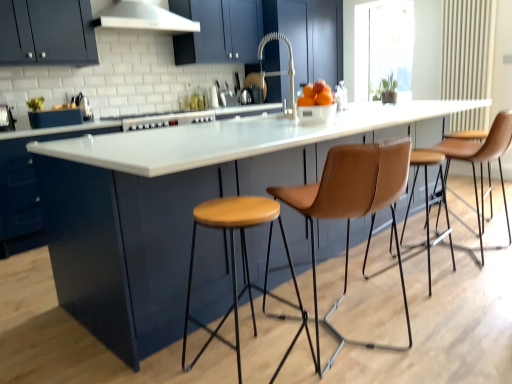
Question: Is brown leather stool at right, which appears as the second chair when viewed from the front, completely or partially inside polished stainless steel kettle at upper left, the second appliance when ordered from left to right?

Choices:
 (A) no
 (B) yes

Answer: (A)

Question: From the image's perspective, is polished stainless steel kettle at upper left, the second appliance when ordered from left to right, on brown leather stool at right, acting as the 1th chair starting from the back?

Choices:
 (A) no
 (B) yes

Answer: (B)

Question: Is polished stainless steel kettle at upper left, the second appliance when ordered from left to right, further to the viewer compared to brown leather stool at right, which ranks as the second chair in left-to-right order?

Choices:
 (A) no
 (B) yes

Answer: (B)

Question: Are polished stainless steel kettle at upper left, marked as the 2th appliance in a front-to-back arrangement, and brown leather stool at right, acting as the 1th chair starting from the back, located far from each other?

Choices:
 (A) no
 (B) yes

Answer: (B)

Question: From the image's perspective, would you say polished stainless steel kettle at upper left, the second appliance when ordered from left to right, is shown under brown leather stool at right, the first chair in the right-to-left sequence?

Choices:
 (A) yes
 (B) no

Answer: (B)

Question: Considering the relative sizes of polished stainless steel kettle at upper left, the 1th appliance when ordered from right to left, and brown leather stool at right, acting as the 1th chair starting from the back, in the image provided, is polished stainless steel kettle at upper left, the 1th appliance when ordered from right to left, bigger than brown leather stool at right, acting as the 1th chair starting from the back,?

Choices:
 (A) yes
 (B) no

Answer: (B)

Question: Does matte dark blue cabinet at upper left, which is the 2th cabinetry from bottom to top, come in front of white matte exhaust hood at upper center?

Choices:
 (A) no
 (B) yes

Answer: (B)

Question: Is matte dark blue cabinet at upper left, which is the 2th cabinetry from bottom to top, positioned with its back to white matte exhaust hood at upper center?

Choices:
 (A) yes
 (B) no

Answer: (B)

Question: From the image's perspective, is matte dark blue cabinet at upper left, which is the 2th cabinetry from bottom to top, located beneath white matte exhaust hood at upper center?

Choices:
 (A) yes
 (B) no

Answer: (A)

Question: Is matte dark blue cabinet at upper left, which is the 2th cabinetry from bottom to top, facing towards white matte exhaust hood at upper center?

Choices:
 (A) yes
 (B) no

Answer: (B)

Question: Is matte dark blue cabinet at upper left, which is the 1th cabinetry in top-to-bottom order, behind white matte exhaust hood at upper center?

Choices:
 (A) no
 (B) yes

Answer: (A)

Question: From a real-world perspective, is matte dark blue cabinet at upper left, which is the 1th cabinetry in top-to-bottom order, under white matte exhaust hood at upper center?

Choices:
 (A) no
 (B) yes

Answer: (B)

Question: Is brown leather stool at right, acting as the 1th chair starting from the back, at the back of transparent glass window at upper right?

Choices:
 (A) yes
 (B) no

Answer: (B)